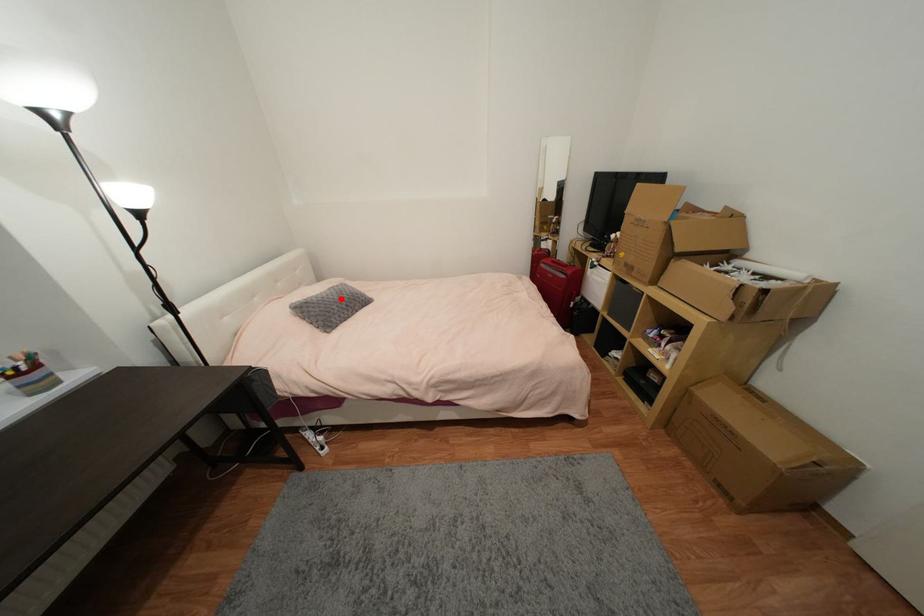
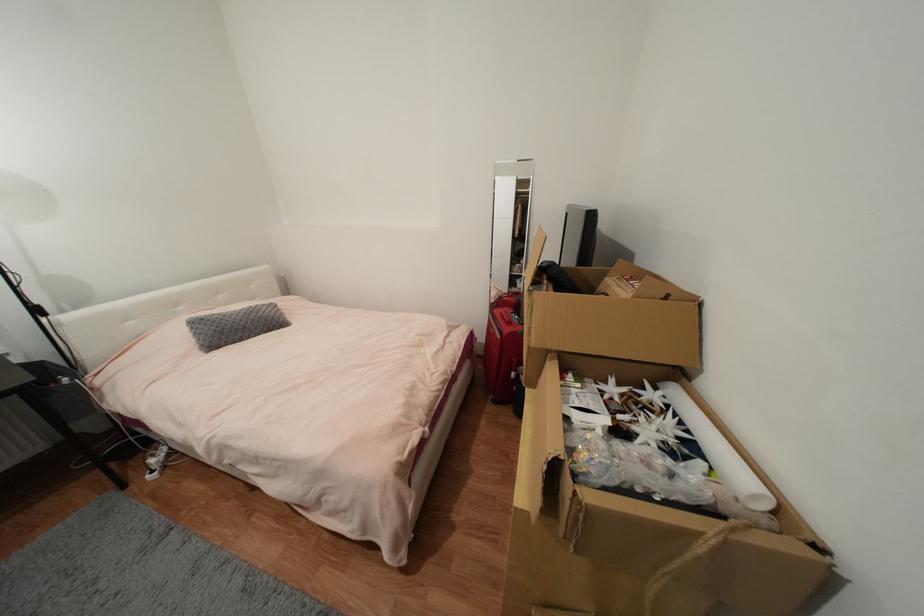
Locate, in the second image, the point that corresponds to the highlighted location in the first image.

(244, 320)